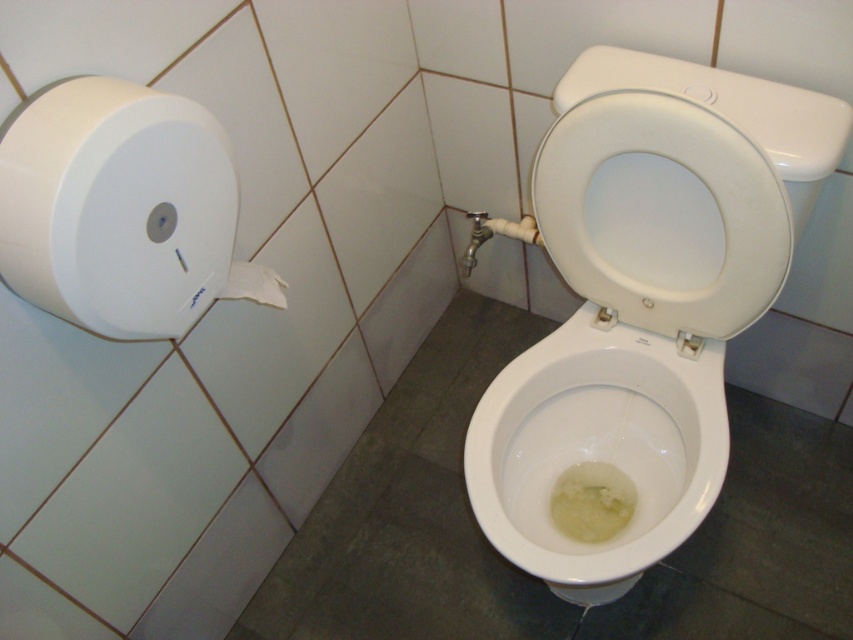
Consider the image. Is white glossy toilet bowl at center to the left of white matte toilet paper at upper left from the viewer's perspective?

No, white glossy toilet bowl at center is not to the left of white matte toilet paper at upper left.

Which is below, white glossy toilet bowl at center or white matte toilet paper at upper left?

white glossy toilet bowl at center

Is point (556, 435) positioned after point (233, 285)?

Yes, it is.

Find the location of a particular element. white glossy toilet bowl at center is located at coordinates (596, 449).

Is white plastic toilet paper at left smaller than white matte toilet paper at upper left?

No.

Does white plastic toilet paper at left have a greater height compared to white matte toilet paper at upper left?

Correct, white plastic toilet paper at left is much taller as white matte toilet paper at upper left.

The width and height of the screenshot is (853, 640). Find the location of `white plastic toilet paper at left`. white plastic toilet paper at left is located at coordinates 115,208.

Image resolution: width=853 pixels, height=640 pixels. In order to click on white plastic toilet paper at left in this screenshot , I will do `click(115, 208)`.

Does white plastic toilet paper at left have a lesser height compared to white glossy toilet bowl at center?

Correct, white plastic toilet paper at left is not as tall as white glossy toilet bowl at center.

Image resolution: width=853 pixels, height=640 pixels. What do you see at coordinates (115, 208) in the screenshot?
I see `white plastic toilet paper at left` at bounding box center [115, 208].

This screenshot has width=853, height=640. What do you see at coordinates (115, 208) in the screenshot?
I see `white plastic toilet paper at left` at bounding box center [115, 208].

Image resolution: width=853 pixels, height=640 pixels. Identify the location of white plastic toilet paper at left. (115, 208).